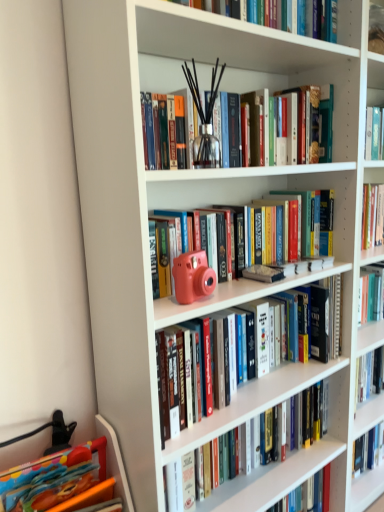
Question: Looking at their shapes, would you say matte pink camera at center, marked as the fourth book in a top-to-bottom arrangement, is wider or thinner than clear glass vase at upper center, which is the 5th book in bottom-to-top order?

Choices:
 (A) thin
 (B) wide

Answer: (B)

Question: From the image's perspective, is matte pink camera at center, marked as the fourth book in a top-to-bottom arrangement, positioned above or below clear glass vase at upper center, which appears as the second book when viewed from the top?

Choices:
 (A) below
 (B) above

Answer: (A)

Question: Which object is the closest to the hardcover book at center, which is counted as the second book, starting from the bottom?

Choices:
 (A) matte pink camera at center, which is counted as the fourth book, starting from the bottom
 (B) clear glass vase at upper center, which appears as the second book when viewed from the top
 (C) matte pink camera at center, marked as the fourth book in a top-to-bottom arrangement
 (D) multicolored plastic toy at lower left, which is the 6th book in top-to-bottom order
 (E) hardcover book at upper center, arranged as the 1th book when viewed from the top

Answer: (C)

Question: Which object is positioned closest to the clear glass vase at upper center, which is the 5th book in bottom-to-top order?

Choices:
 (A) multicolored plastic toy at lower left, which is the 6th book in top-to-bottom order
 (B) matte pink camera at center, positioned as the 3th book in top-to-bottom order
 (C) hardcover book at center, which is counted as the second book, starting from the bottom
 (D) hardcover book at upper center, arranged as the 1th book when viewed from the top
 (E) matte pink camera at center, marked as the fourth book in a top-to-bottom arrangement

Answer: (B)